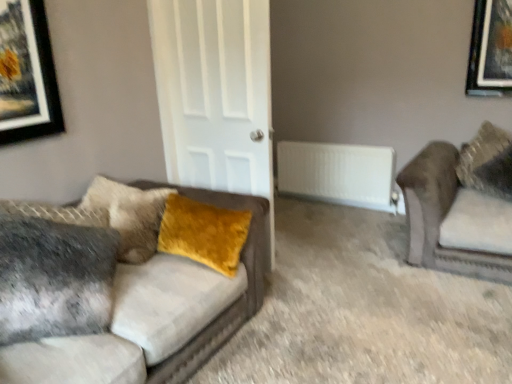
Question: Are white matte door at center and white plastic radiator at center beside each other?

Choices:
 (A) no
 (B) yes

Answer: (A)

Question: From the image's perspective, does white matte door at center appear lower than white plastic radiator at center?

Choices:
 (A) yes
 (B) no

Answer: (B)

Question: From a real-world perspective, is white matte door at center on top of white plastic radiator at center?

Choices:
 (A) yes
 (B) no

Answer: (A)

Question: Can you confirm if white matte door at center is smaller than white plastic radiator at center?

Choices:
 (A) no
 (B) yes

Answer: (A)

Question: Is white matte door at center facing towards white plastic radiator at center?

Choices:
 (A) yes
 (B) no

Answer: (A)

Question: Considering the relative positions of white matte door at center and white plastic radiator at center in the image provided, is white matte door at center to the left of white plastic radiator at center from the viewer's perspective?

Choices:
 (A) no
 (B) yes

Answer: (B)

Question: Is white matte door at center not near velvet brown couch at right, which is the 2th studio couch from left to right?

Choices:
 (A) yes
 (B) no

Answer: (A)

Question: Does white matte door at center have a greater height compared to velvet brown couch at right, which is the 2th studio couch from left to right?

Choices:
 (A) yes
 (B) no

Answer: (A)

Question: Is white matte door at center to the left of velvet brown couch at right, the first studio couch in the right-to-left sequence, from the viewer's perspective?

Choices:
 (A) no
 (B) yes

Answer: (B)

Question: From the image's perspective, is white matte door at center located beneath velvet brown couch at right, the first studio couch in the right-to-left sequence?

Choices:
 (A) no
 (B) yes

Answer: (A)

Question: From the image's perspective, would you say white matte door at center is positioned over velvet brown couch at right, the first studio couch in the right-to-left sequence?

Choices:
 (A) yes
 (B) no

Answer: (A)

Question: Considering the relative sizes of white matte door at center and velvet brown couch at right, the first studio couch in the right-to-left sequence, in the image provided, is white matte door at center bigger than velvet brown couch at right, the first studio couch in the right-to-left sequence,?

Choices:
 (A) no
 (B) yes

Answer: (A)

Question: Is velvet yellow pillow at upper right, which is the second pillow in front-to-back order, taller than white plastic radiator at center?

Choices:
 (A) no
 (B) yes

Answer: (B)